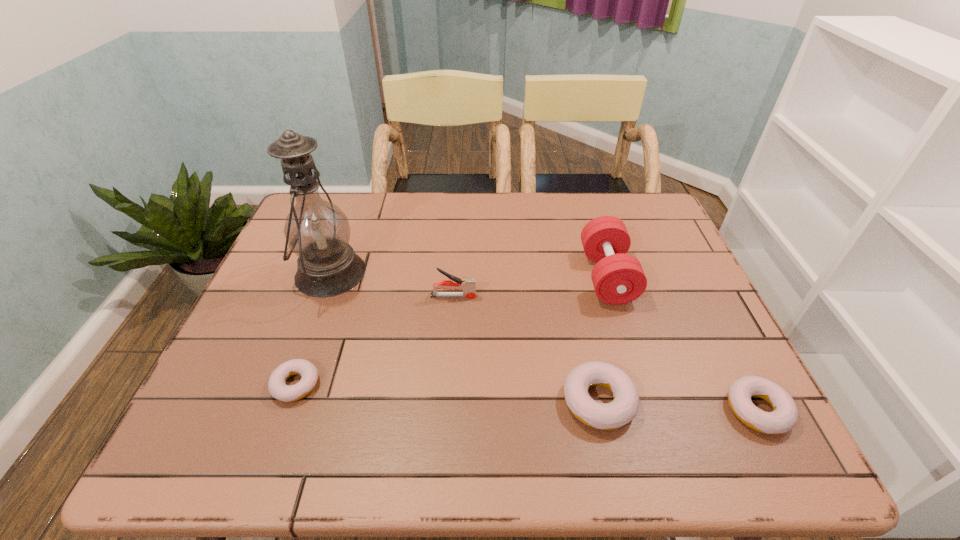
Identify the location of the shortest object. This screenshot has width=960, height=540. (277, 386).

I want to click on the leftmost doughnut, so click(x=277, y=386).

Where is `the second doughnut from left to right`? Image resolution: width=960 pixels, height=540 pixels. the second doughnut from left to right is located at coordinates (606, 416).

You are a GUI agent. You are given a task and a screenshot of the screen. Output one action in this format:
    pyautogui.click(x=<x>, y=<y>)
    Task: Click on the fourth tallest object
    The height and width of the screenshot is (540, 960).
    Given the screenshot: What is the action you would take?
    pyautogui.click(x=606, y=416)

Find the location of a particular element. This screenshot has height=540, width=960. the rightmost doughnut is located at coordinates (784, 416).

Find the location of `the fifth tallest object`. the fifth tallest object is located at coordinates (784, 416).

I want to click on the fourth object from right to left, so click(468, 285).

Find the location of `stapler`. stapler is located at coordinates (468, 285).

Find the location of a particular element. The width and height of the screenshot is (960, 540). dumbbell is located at coordinates (618, 278).

Where is `oil lamp`? The height and width of the screenshot is (540, 960). oil lamp is located at coordinates (317, 231).